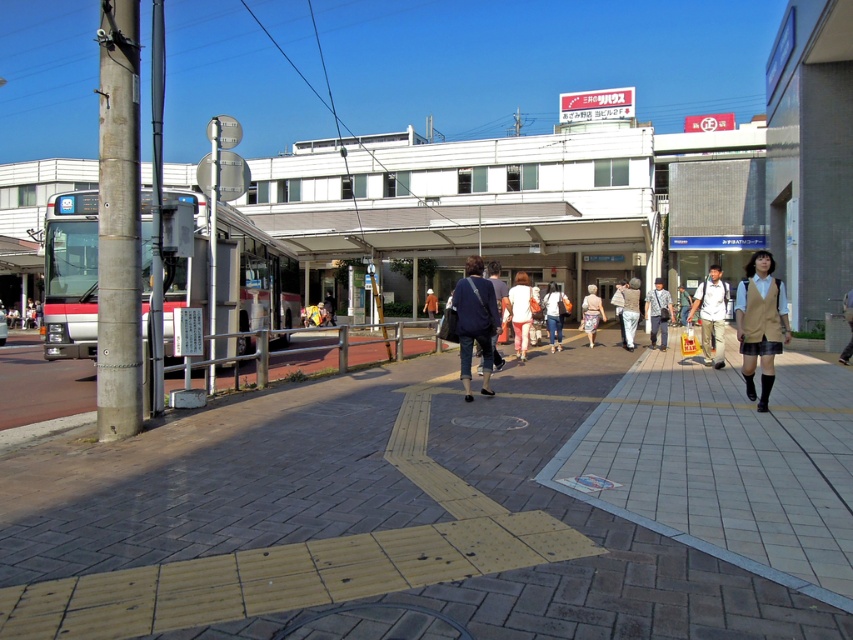
You are a pedestrian trying to cross the yellow pedestrian crossing at the center. There are two people standing on the crossing, one wearing white fabric pants at center and another wearing dark blue jeans at center. Which person is more likely to block your path if you walk straight ahead?

The white fabric pants at center might be wider than dark blue jeans at center, so the person wearing white fabric pants at center is more likely to block your path if you walk straight ahead.

You are a photographer standing at the train station. You see two people wearing white fabric pants at center and dark blue jeans at center. Which clothing item is bigger in size?

The white fabric pants at center is larger in size than dark blue jeans at center.